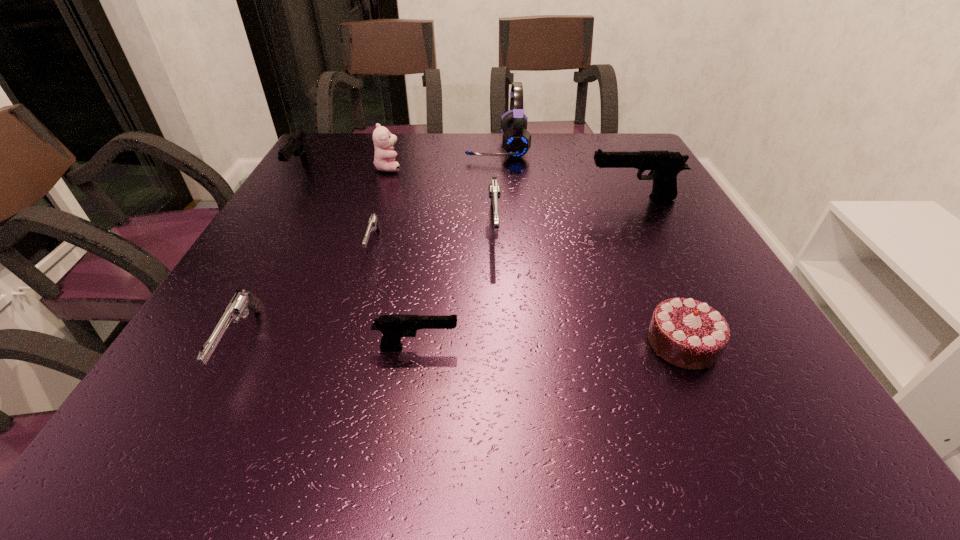
Where is `the tallest object`? The image size is (960, 540). the tallest object is located at coordinates (516, 141).

I want to click on the rightmost black pistol, so click(x=664, y=165).

Image resolution: width=960 pixels, height=540 pixels. Identify the location of the tallest pistol. pos(664,165).

At what (x,y) coordinates should I click in order to perform the action: click on pink teddy bear. Please return your answer as a coordinate pair (x, y). The image size is (960, 540). Looking at the image, I should click on point(384,159).

Where is `the farthest pistol`? The width and height of the screenshot is (960, 540). the farthest pistol is located at coordinates (297, 145).

Where is `the leftmost pistol`? This screenshot has width=960, height=540. the leftmost pistol is located at coordinates (297, 145).

The image size is (960, 540). I want to click on the rightmost silver pistol, so click(494, 189).

This screenshot has height=540, width=960. Identify the location of the second pistol from right to left. (494, 189).

Where is `the nearest black pistol`? The height and width of the screenshot is (540, 960). the nearest black pistol is located at coordinates (393, 327).

This screenshot has width=960, height=540. What are the coordinates of `the smallest black pistol` in the screenshot? It's located at (393, 327).